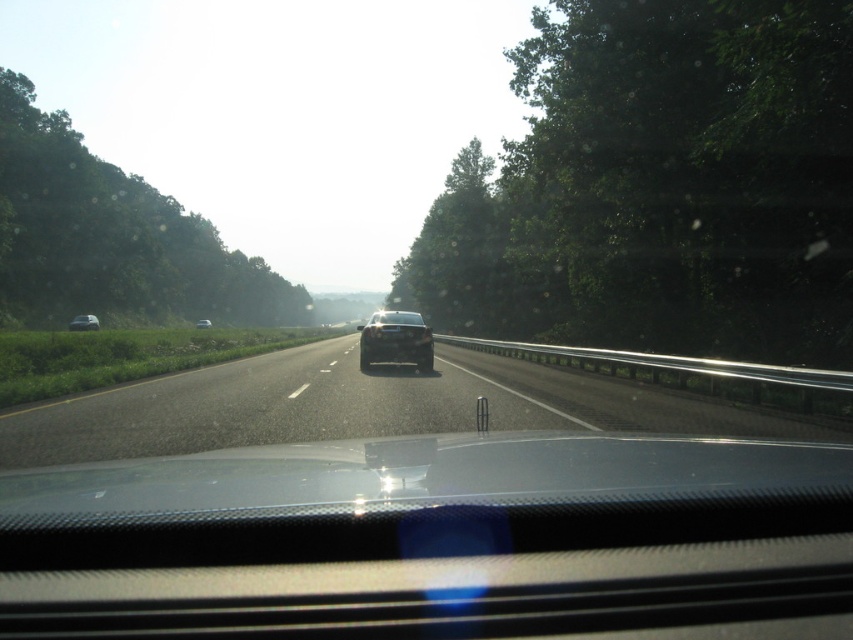
Question: Which point is farther to the camera?

Choices:
 (A) black asphalt highway at center
 (B) satin black sedan at center
 (C) metallic silver car at left

Answer: (C)

Question: Can you confirm if satin black sedan at center is thinner than white glossy sedan at center?

Choices:
 (A) yes
 (B) no

Answer: (A)

Question: Is black asphalt highway at center smaller than satin black sedan at center?

Choices:
 (A) yes
 (B) no

Answer: (B)

Question: Does black asphalt highway at center appear under white glossy sedan at center?

Choices:
 (A) yes
 (B) no

Answer: (A)

Question: Which object is the farthest from the black asphalt highway at center?

Choices:
 (A) satin black sedan at center
 (B) white glossy sedan at center
 (C) metallic silver car at left

Answer: (B)

Question: Which point is closer to the camera?

Choices:
 (A) (566, 422)
 (B) (77, 324)
 (C) (426, 337)

Answer: (A)